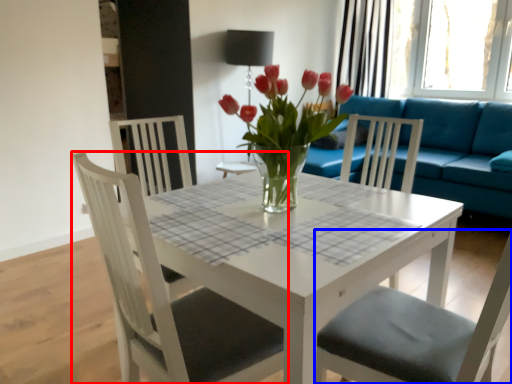
Question: Which object is further to the camera taking this photo, chair (highlighted by a red box) or chair (highlighted by a blue box)?

Choices:
 (A) chair
 (B) chair

Answer: (A)